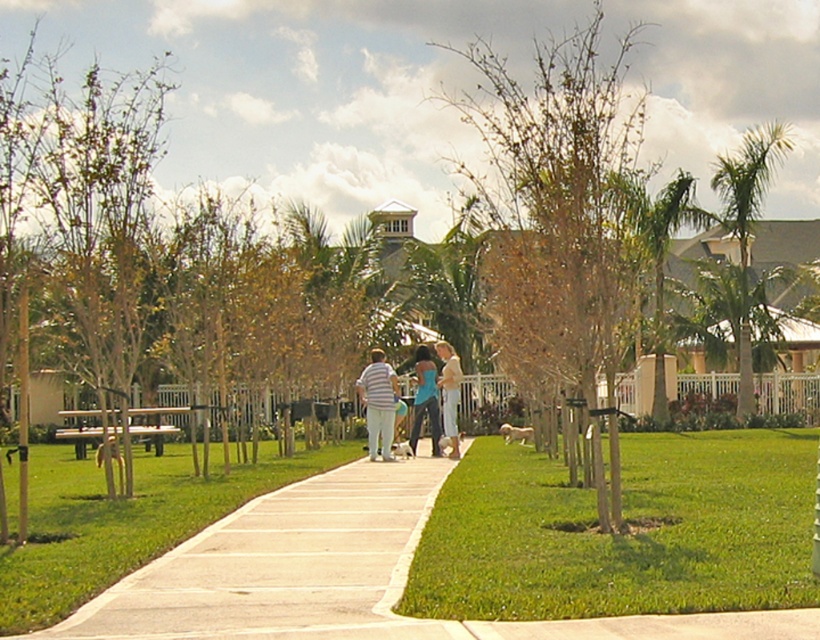
You are a gardener standing at the edge of the pathway and see the brown leafy tree at center and the light blue denim jeans at center. Which object is positioned to the right side of the other?

The brown leafy tree at center is to the right of the light blue denim jeans at center.

You are a photographer standing at the point labeled point (377, 403). You want to capture a photo of the striped cotton shirt at center. Is there any obstruction between your current position and the striped cotton shirt at center?

The point (377, 403) corresponds to the striped cotton shirt at center, so there is no obstruction between your current position and the striped cotton shirt at center.